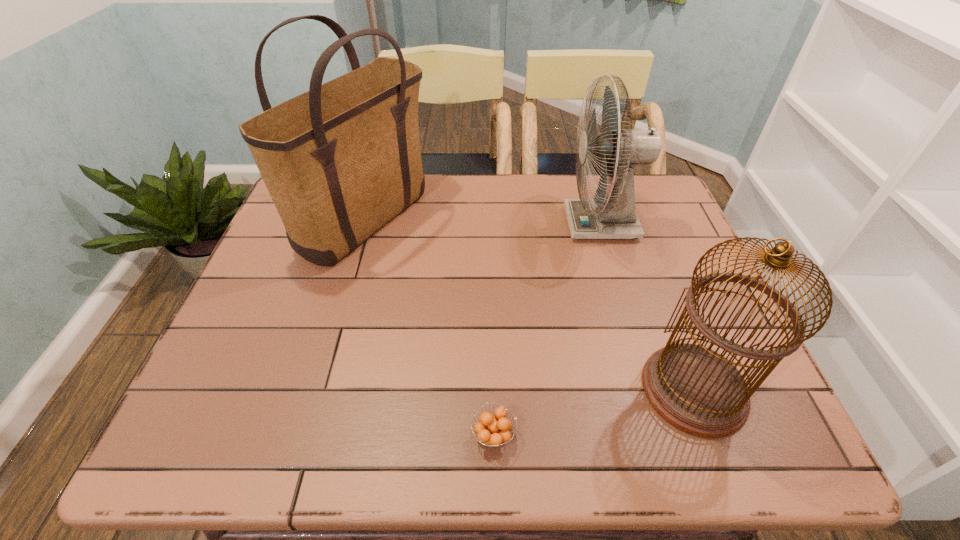
Where is `free space that is in between the tote bag and the birdcage`? free space that is in between the tote bag and the birdcage is located at coordinates (530, 305).

This screenshot has height=540, width=960. I want to click on free area in between the orange fruit and the fan, so click(x=547, y=329).

Image resolution: width=960 pixels, height=540 pixels. I want to click on empty space between the second object from left to right and the leftmost object, so click(x=430, y=327).

Identify the location of free spot between the fan and the tote bag. (484, 222).

Find the location of a particular element. This screenshot has width=960, height=540. empty location between the tote bag and the birdcage is located at coordinates (530, 305).

I want to click on unoccupied area between the fan and the leftmost object, so click(484, 222).

This screenshot has width=960, height=540. Identify the location of empty location between the orange fruit and the fan. (547, 329).

Where is `free space between the tallest object and the shortest object`? The width and height of the screenshot is (960, 540). free space between the tallest object and the shortest object is located at coordinates (430, 327).

Locate an element on the screen. The image size is (960, 540). free space between the tallest object and the birdcage is located at coordinates (530, 305).

Where is `unoccupied position between the birdcage and the fan`? Image resolution: width=960 pixels, height=540 pixels. unoccupied position between the birdcage and the fan is located at coordinates (647, 307).